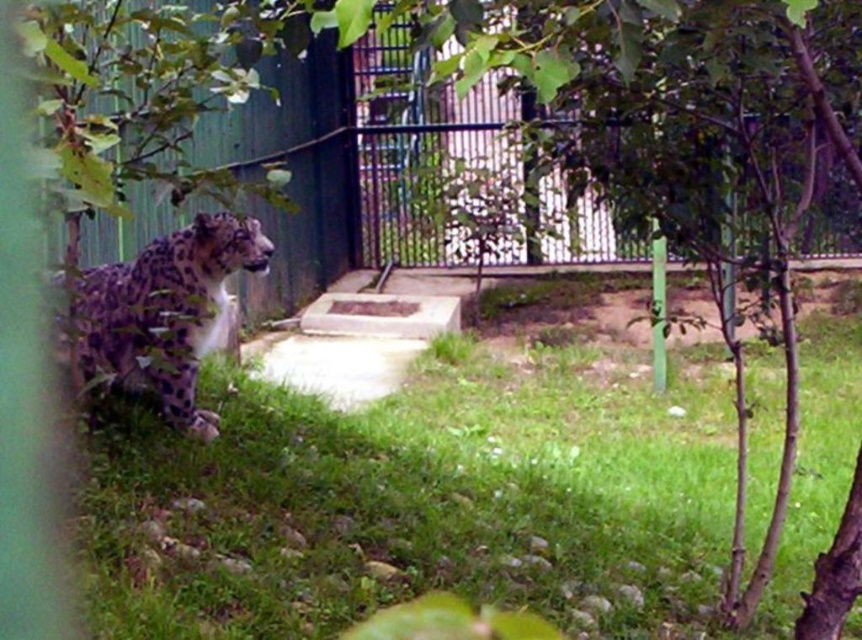
Question: Is green leafy tree at center thinner than spotted fur leopard at left?

Choices:
 (A) yes
 (B) no

Answer: (B)

Question: Is green grass at lower center thinner than green leafy tree at center?

Choices:
 (A) yes
 (B) no

Answer: (A)

Question: Can you confirm if metallic gate at center is positioned to the right of spotted fur leopard at left?

Choices:
 (A) no
 (B) yes

Answer: (B)

Question: Which point is closer to the camera?

Choices:
 (A) (779, 572)
 (B) (806, 29)
 (C) (180, 420)

Answer: (B)

Question: Which point is farther from the camera taking this photo?

Choices:
 (A) (364, 563)
 (B) (532, 86)

Answer: (B)

Question: Which object is farther from the camera taking this photo?

Choices:
 (A) green grass at lower center
 (B) spotted fur leopard at left

Answer: (B)